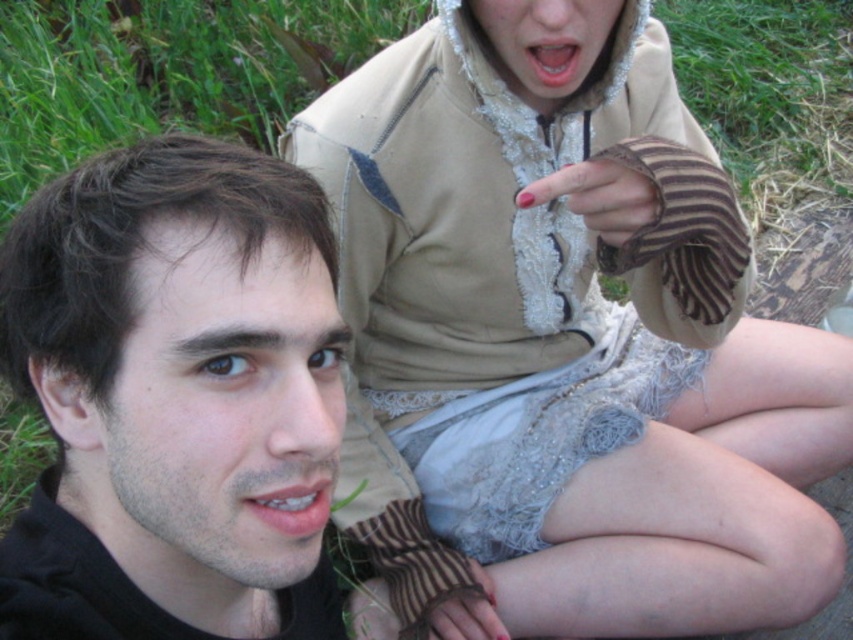
Is point (310, 138) farther from camera compared to point (296, 490)?

Yes, point (310, 138) is behind point (296, 490).

Measure the distance between point (469, 173) and camera.

Point (469, 173) is 3.91 feet from camera.

Which is in front, point (642, 442) or point (316, 509)?

Point (316, 509) is in front.

Identify the location of light brown textured hoodie at upper center. The height and width of the screenshot is (640, 853). (564, 346).

Does smooth black face at center have a greater height compared to smooth pink lips at upper center?

Yes, smooth black face at center is taller than smooth pink lips at upper center.

This screenshot has height=640, width=853. Describe the element at coordinates (178, 376) in the screenshot. I see `smooth black face at center` at that location.

What do you see at coordinates (178, 376) in the screenshot? I see `smooth black face at center` at bounding box center [178, 376].

The height and width of the screenshot is (640, 853). What are the coordinates of `smooth black face at center` in the screenshot? It's located at (178, 376).

What do you see at coordinates (564, 346) in the screenshot? The height and width of the screenshot is (640, 853). I see `light brown textured hoodie at upper center` at bounding box center [564, 346].

Is light brown textured hoodie at upper center in front of smooth pink lips at upper center?

That is True.

Is point (601, 592) less distant than point (573, 88)?

No.

In order to click on light brown textured hoodie at upper center in this screenshot , I will do `click(564, 346)`.